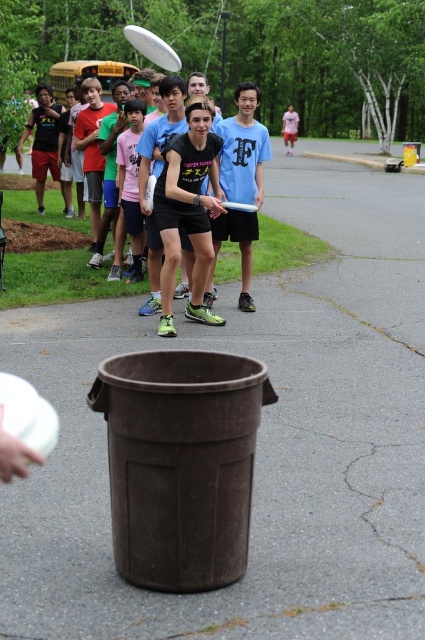
Between point (56, 77) and point (282, 122), which one is positioned in front?

Point (56, 77) is in front.

Which is in front, point (102, 67) or point (289, 118)?

Point (102, 67)

Locate an element on the screen. The height and width of the screenshot is (640, 425). yellow metallic school bus at upper left is located at coordinates (87, 76).

Is matte black t-shirt at center bigger than yellow metallic school bus at upper left?

Actually, matte black t-shirt at center might be smaller than yellow metallic school bus at upper left.

Image resolution: width=425 pixels, height=640 pixels. What are the coordinates of `matte black t-shirt at center` in the screenshot? It's located at (201, 195).

Is point (195, 234) in front of point (283, 122)?

Yes, point (195, 234) is closer to viewer.

Does matte black t-shirt at center have a greater height compared to pink cotton shirt at center?

No, matte black t-shirt at center is not taller than pink cotton shirt at center.

Is point (204, 99) positioned before point (295, 132)?

Yes, point (204, 99) is closer to viewer.

The image size is (425, 640). What are the coordinates of `matte black t-shirt at center` in the screenshot? It's located at (201, 195).